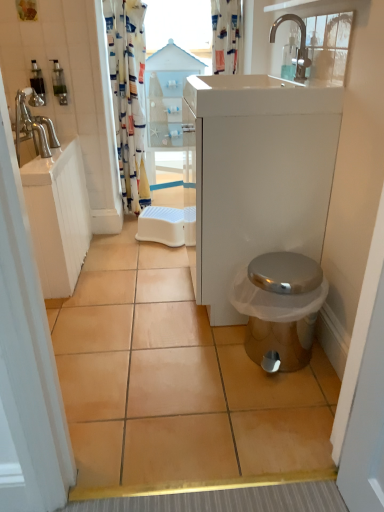
The height and width of the screenshot is (512, 384). Identify the location of vacant space situated above beige ceramic tile at center (from a real-world perspective). (160, 315).